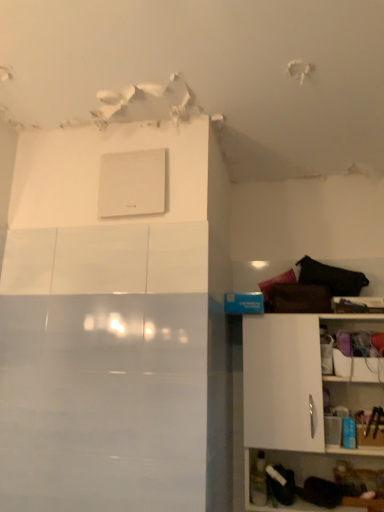
The height and width of the screenshot is (512, 384). Find the location of `white matte cabinet at right`. white matte cabinet at right is located at coordinates (299, 389).

Describe the element at coordinates (299, 389) in the screenshot. This screenshot has width=384, height=512. I see `white matte cabinet at right` at that location.

Locate an element on the screen. white matte switch at upper center is located at coordinates (132, 183).

What is the approximate height of white matte switch at upper center?

It is 27.79 centimeters.

Describe the element at coordinates (132, 183) in the screenshot. I see `white matte switch at upper center` at that location.

Where is `white matte cabinet at right`? white matte cabinet at right is located at coordinates (299, 389).

Is white matte cabinet at right at the right side of white matte switch at upper center?

Indeed, white matte cabinet at right is positioned on the right side of white matte switch at upper center.

Is white matte cabinet at right closer to camera compared to white matte switch at upper center?

Yes, white matte cabinet at right is in front of white matte switch at upper center.

Does point (286, 324) come closer to viewer compared to point (129, 156)?

No, it is behind (129, 156).

From the image's perspective, is white matte cabinet at right located above white matte switch at upper center?

No, from the image's perspective, white matte cabinet at right is not above white matte switch at upper center.

From a real-world perspective, does white matte cabinet at right sit lower than white matte switch at upper center?

Yes, from a real-world perspective, white matte cabinet at right is below white matte switch at upper center.

Is white matte cabinet at right thinner than white matte switch at upper center?

No.

Considering the sizes of white matte cabinet at right and white matte switch at upper center in the image, is white matte cabinet at right taller or shorter than white matte switch at upper center?

In the image, white matte cabinet at right appears to be taller than white matte switch at upper center.

Considering the sizes of white matte cabinet at right and white matte switch at upper center in the image, is white matte cabinet at right bigger or smaller than white matte switch at upper center?

white matte cabinet at right is bigger than white matte switch at upper center.

Is white matte cabinet at right located outside white matte switch at upper center?

white matte cabinet at right lies outside white matte switch at upper center's area.

Would you say white matte cabinet at right is a long distance from white matte switch at upper center?

They are positioned close to each other.

Is white matte switch at upper center at the back of white matte cabinet at right?

That's not correct — white matte cabinet at right is not looking away from white matte switch at upper center.

How many degrees apart are the facing directions of white matte cabinet at right and white matte switch at upper center?

The angle between the facing direction of white matte cabinet at right and the facing direction of white matte switch at upper center is 3.52 degrees.

The height and width of the screenshot is (512, 384). I want to click on shelf in front of the white matte switch at upper center, so [299, 389].

Does white matte switch at upper center appear on the left side of white matte cabinet at right?

Yes, white matte switch at upper center is to the left of white matte cabinet at right.

Looking at this image, is the position of white matte switch at upper center more distant than that of white matte cabinet at right?

Yes, white matte switch at upper center is further from the viewer.

Is point (142, 180) closer to viewer compared to point (297, 442)?

Yes.

From the image's perspective, relative to white matte cabinet at right, is white matte switch at upper center above or below?

Clearly, from the image's perspective, white matte switch at upper center is above white matte cabinet at right.

From a real-world perspective, who is located higher, white matte switch at upper center or white matte cabinet at right?

white matte switch at upper center, from a real-world perspective.

Can you confirm if white matte switch at upper center is wider than white matte cabinet at right?

No, white matte switch at upper center is not wider than white matte cabinet at right.

Between white matte switch at upper center and white matte cabinet at right, which one has more height?

With more height is white matte cabinet at right.

Does white matte switch at upper center have a larger size compared to white matte cabinet at right?

Actually, white matte switch at upper center might be smaller than white matte cabinet at right.

Is white matte switch at upper center not within white matte cabinet at right?

Yes, white matte switch at upper center is outside of white matte cabinet at right.

Is white matte switch at upper center next to white matte cabinet at right?

No, white matte switch at upper center is not touching white matte cabinet at right.

Is white matte switch at upper center oriented away from white matte cabinet at right?

white matte switch at upper center is not turned away from white matte cabinet at right.

How different are the orientations of white matte switch at upper center and white matte cabinet at right in degrees?

There is a 3.52-degree angle between the facing directions of white matte switch at upper center and white matte cabinet at right.

Where is `shelf that is on the right side of white matte switch at upper center`? The image size is (384, 512). shelf that is on the right side of white matte switch at upper center is located at coordinates (299, 389).

The image size is (384, 512). In the image, there is a white matte cabinet at right. Find the location of `appliance above it (from the image's perspective)`. appliance above it (from the image's perspective) is located at coordinates (132, 183).

Identify the location of appliance lying behind the white matte cabinet at right. This screenshot has height=512, width=384. (132, 183).